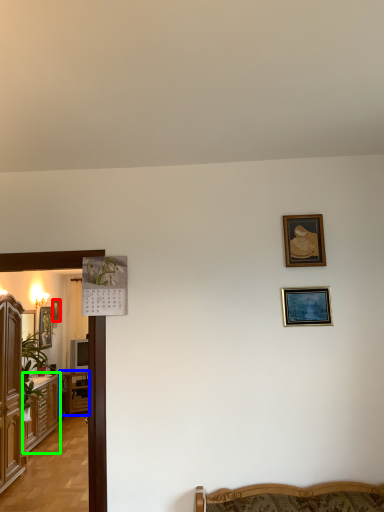
Question: Considering the real-world distances, which object is farthest from picture frame (highlighted by a red box)? table (highlighted by a blue box) or cabinetry (highlighted by a green box)?

Choices:
 (A) table
 (B) cabinetry

Answer: (B)